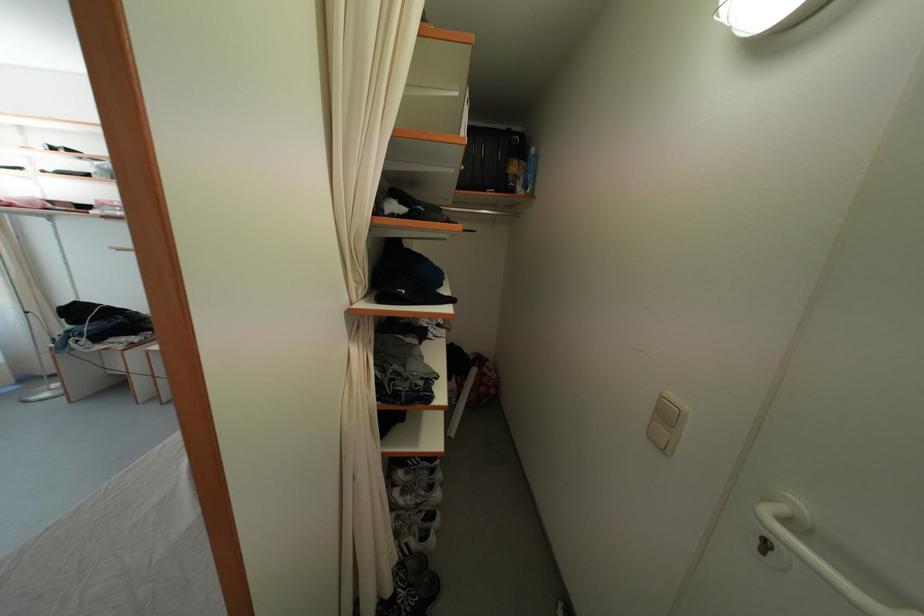
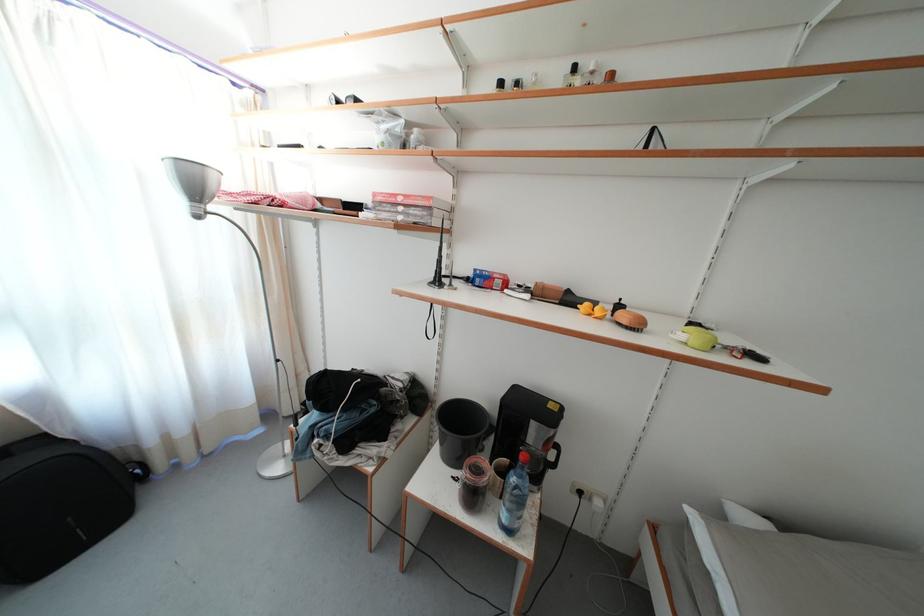
In a continuous first-person perspective shot, in which direction is the camera moving?

The cameraman walked toward left, forward.